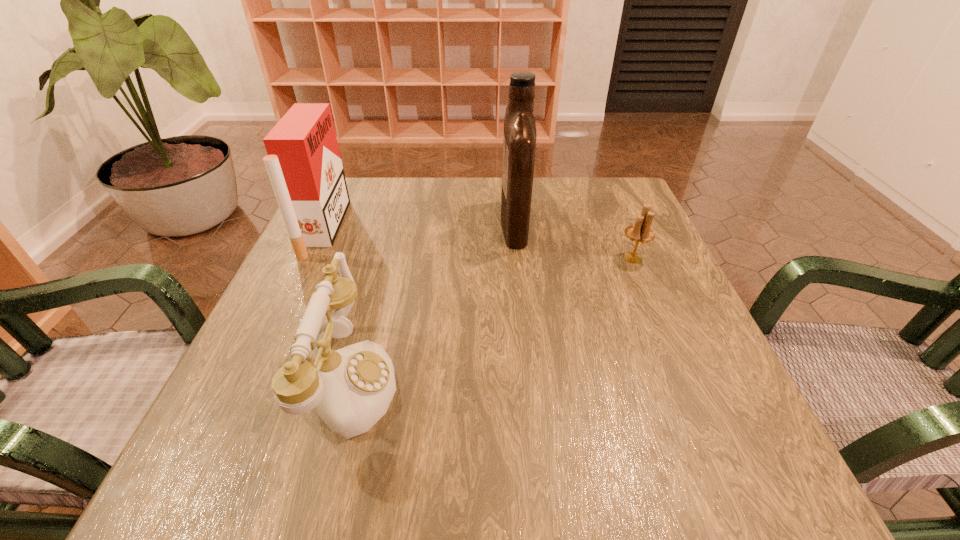
The width and height of the screenshot is (960, 540). Find the location of `free space that satisfies the following two spatial constraints: 1. on the back side of the rightmost object; 2. on the front-facing side of the leftmost object`. free space that satisfies the following two spatial constraints: 1. on the back side of the rightmost object; 2. on the front-facing side of the leftmost object is located at coordinates (621, 229).

Locate an element on the screen. The image size is (960, 540). free location that satisfies the following two spatial constraints: 1. on the label side of the third object from left to right; 2. on the left side of the shortest object is located at coordinates (518, 258).